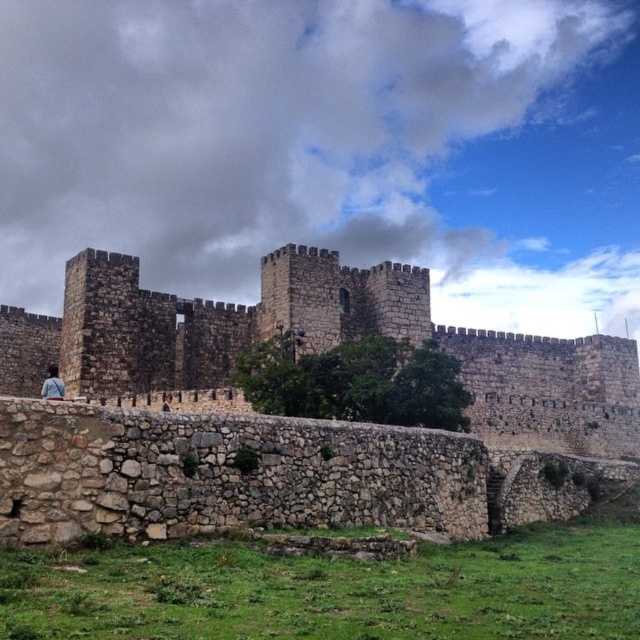
Question: Which point is closer to the camera taking this photo?

Choices:
 (A) (26, 317)
 (B) (49, 392)

Answer: (B)

Question: Among these points, which one is farthest from the camera?

Choices:
 (A) (54, 397)
 (B) (84, 285)

Answer: (B)

Question: Which point is closer to the camera taking this photo?

Choices:
 (A) (52, 396)
 (B) (154, 356)

Answer: (A)

Question: Is brown stone castle at center below denim jacket at lower left?

Choices:
 (A) yes
 (B) no

Answer: (B)

Question: Does brown stone castle at center have a larger size compared to denim jacket at lower left?

Choices:
 (A) no
 (B) yes

Answer: (B)

Question: Is brown stone castle at center below denim jacket at lower left?

Choices:
 (A) yes
 (B) no

Answer: (B)